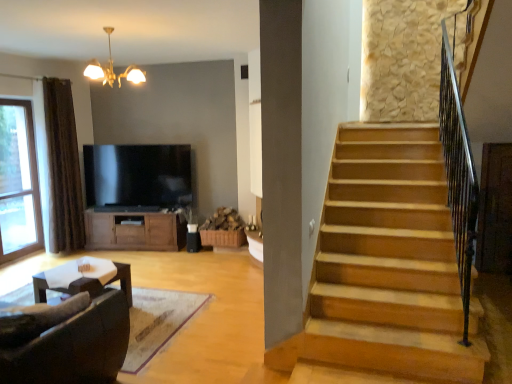
Question: From a real-world perspective, is gold metallic chandelier at upper center physically below flat screen tv at center?

Choices:
 (A) no
 (B) yes

Answer: (A)

Question: Is flat screen tv at center located within gold metallic chandelier at upper center?

Choices:
 (A) yes
 (B) no

Answer: (B)

Question: Are gold metallic chandelier at upper center and flat screen tv at center far apart?

Choices:
 (A) no
 (B) yes

Answer: (B)

Question: Is the depth of gold metallic chandelier at upper center greater than that of flat screen tv at center?

Choices:
 (A) no
 (B) yes

Answer: (A)

Question: Is gold metallic chandelier at upper center wider than flat screen tv at center?

Choices:
 (A) no
 (B) yes

Answer: (B)

Question: Can you see gold metallic chandelier at upper center touching flat screen tv at center?

Choices:
 (A) no
 (B) yes

Answer: (A)

Question: Does brown wood cabinet at center have a lesser height compared to gold metallic chandelier at upper center?

Choices:
 (A) yes
 (B) no

Answer: (B)

Question: From a real-world perspective, is brown wood cabinet at center positioned under gold metallic chandelier at upper center based on gravity?

Choices:
 (A) yes
 (B) no

Answer: (A)

Question: Can you confirm if brown wood cabinet at center is smaller than gold metallic chandelier at upper center?

Choices:
 (A) yes
 (B) no

Answer: (B)

Question: Does brown wood cabinet at center have a lesser width compared to gold metallic chandelier at upper center?

Choices:
 (A) no
 (B) yes

Answer: (B)

Question: Can you confirm if brown wood cabinet at center is wider than gold metallic chandelier at upper center?

Choices:
 (A) no
 (B) yes

Answer: (A)

Question: Does brown wood cabinet at center turn towards gold metallic chandelier at upper center?

Choices:
 (A) yes
 (B) no

Answer: (B)

Question: From a real-world perspective, is gold metallic chandelier at upper center beneath transparent glass window at left?

Choices:
 (A) yes
 (B) no

Answer: (B)